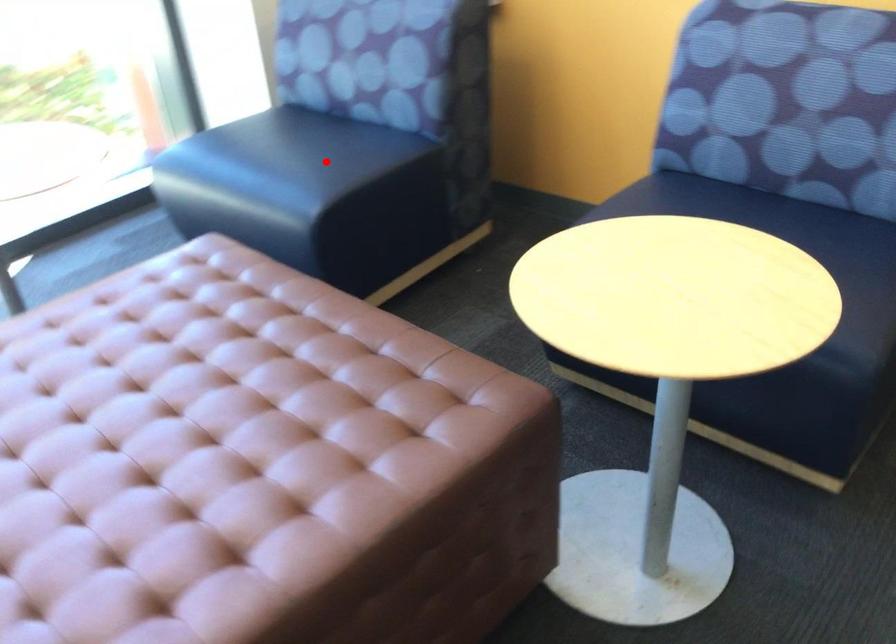
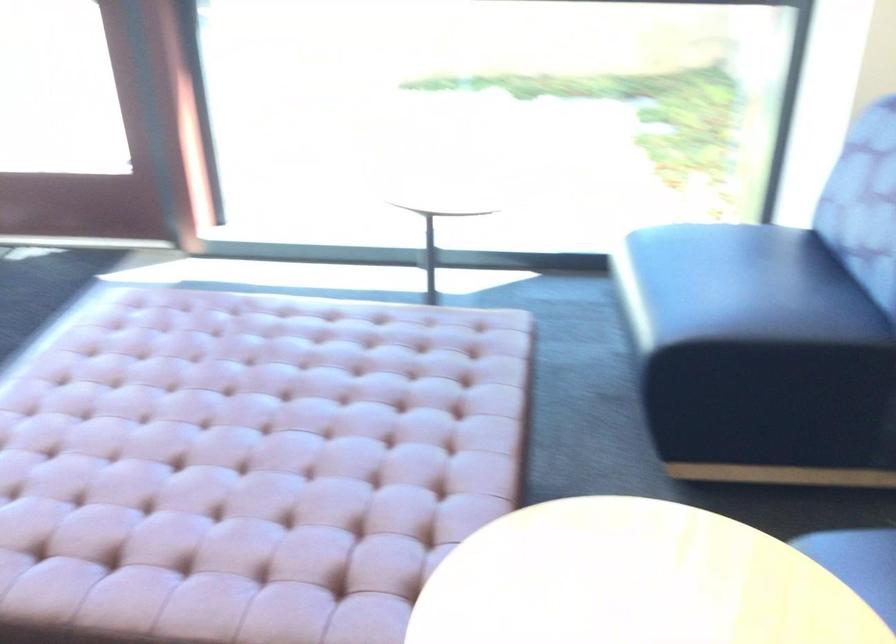
Question: I am providing you with two images of the same scene from different viewpoints. Given a red point in image1, look at the same physical point in image2. Is it:

Choices:
 (A) Closer to the viewpoint
 (B) Farther from the viewpoint

Answer: (A)